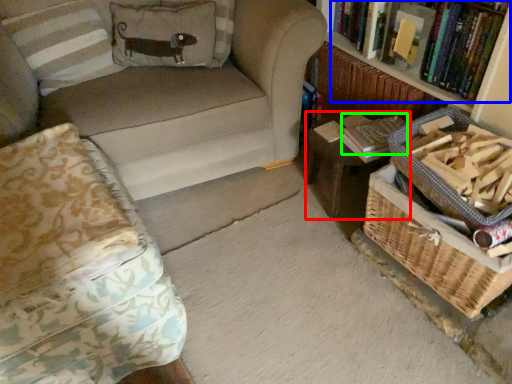
Question: Which object is the farthest from table (highlighted by a red box)? Choose among these: book (highlighted by a blue box) or paperback book (highlighted by a green box).

Choices:
 (A) book
 (B) paperback book

Answer: (A)